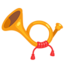
The image size is (64, 64). I want to click on bowl of horn, so click(14, 23).